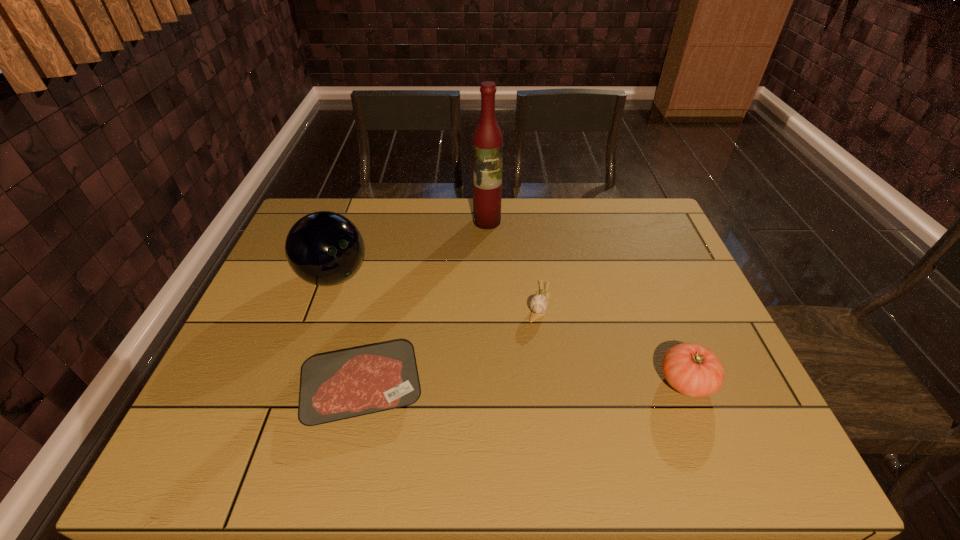
The height and width of the screenshot is (540, 960). What are the coordinates of `steak positioned at the near edge` in the screenshot? It's located at pyautogui.click(x=339, y=385).

The height and width of the screenshot is (540, 960). In order to click on tomato that is at the near edge in this screenshot , I will do `click(691, 369)`.

The width and height of the screenshot is (960, 540). Identify the location of object that is at the left edge. (323, 248).

The height and width of the screenshot is (540, 960). I want to click on object that is positioned at the right edge, so click(691, 369).

Locate an element on the screen. The width and height of the screenshot is (960, 540). object that is at the near right corner is located at coordinates (691, 369).

The image size is (960, 540). In the image, there is a desktop. What are the coordinates of `vacant space at the far edge` in the screenshot? It's located at (530, 234).

In order to click on vacant space at the near edge of the desktop in this screenshot , I will do `click(469, 416)`.

Image resolution: width=960 pixels, height=540 pixels. I want to click on free location at the right edge, so click(x=638, y=246).

This screenshot has height=540, width=960. What are the coordinates of `vacant region at the near left corner` in the screenshot? It's located at (213, 400).

I want to click on free space between the bowling ball and the tomato, so click(510, 329).